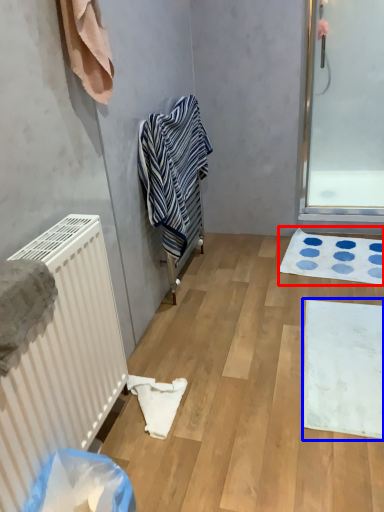
Question: Among these objects, which one is nearest to the camera, bath mat (highlighted by a red box) or bath mat (highlighted by a blue box)?

Choices:
 (A) bath mat
 (B) bath mat

Answer: (B)